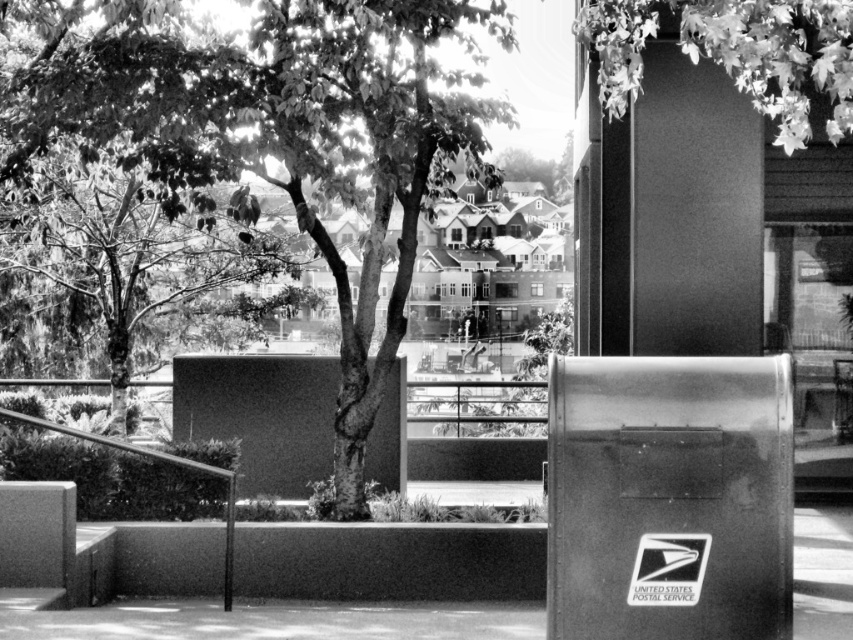
You are a painter standing in front of the USPS mailbox on the right. You want to paint the smooth green tree at center and the leaves at upper right. Which object should you focus on first if you want to paint the wider one?

The smooth green tree at center might be wider than leaves at upper right, so you should focus on painting the smooth green tree at center first.

You are a delivery person trying to find the USPS mailbox. You see the smooth green tree at upper left and the smooth concrete pavement at lower center. Which object is higher in the image?

The smooth green tree at upper left is above the smooth concrete pavement at lower center, so the smooth green tree at upper left is higher in the image.

You are a photographer trying to capture the smooth green tree at upper left and the leaves at upper right in your shot. Which object is closer to the camera?

The smooth green tree at upper left is closer to the camera because the leaves at upper right are positioned behind it.